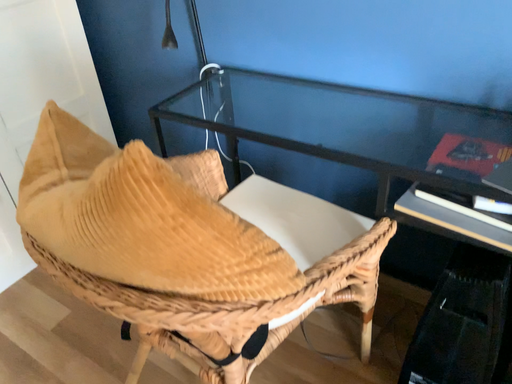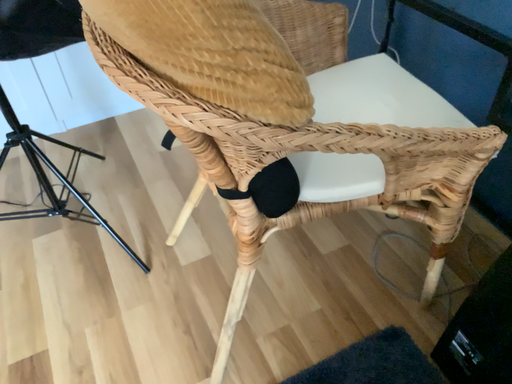
Question: Which way did the camera rotate in the video?

Choices:
 (A) rotated upward
 (B) rotated downward

Answer: (B)